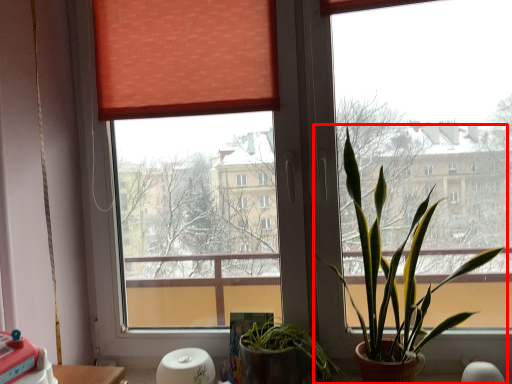
Question: From the image's perspective, considering the relative positions of houseplant (annotated by the red box) and table in the image provided, where is houseplant (annotated by the red box) located with respect to the staircase?

Choices:
 (A) below
 (B) above

Answer: (B)